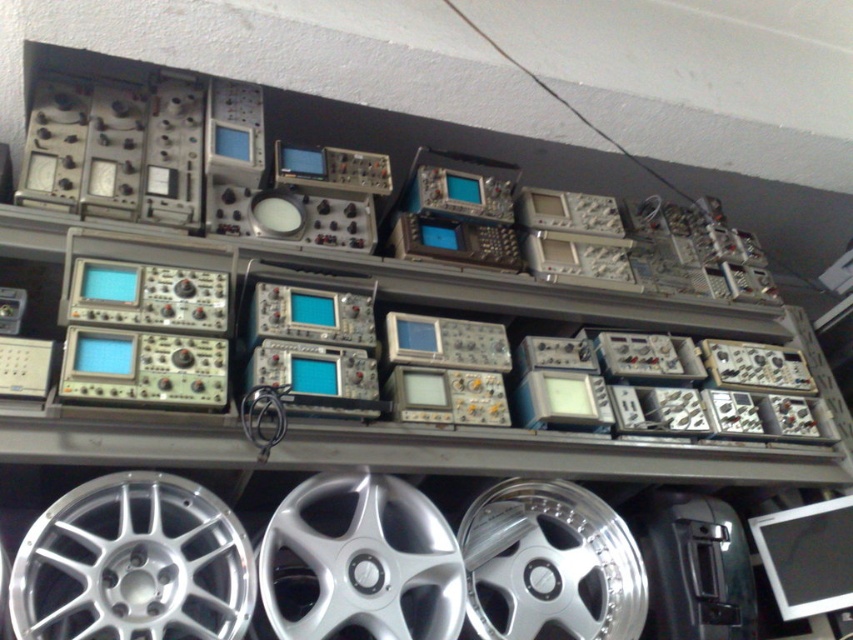
From the picture: Between silver metallic wheel at center and silver polished wheel at lower center, which one appears on the left side from the viewer's perspective?

Positioned to the left is silver metallic wheel at center.

From the picture: Is silver metallic wheel at center wider than silver polished wheel at lower center?

No, silver metallic wheel at center is not wider than silver polished wheel at lower center.

Is point (370, 604) closer to camera compared to point (546, 605)?

Yes, point (370, 604) is closer to viewer.

At what (x,y) coordinates should I click in order to perform the action: click on silver metallic wheel at center. Please return your answer as a coordinate pair (x, y). Looking at the image, I should click on (364, 561).

Can you confirm if silver metallic wheel at lower left is positioned to the left of silver metallic wheel at center?

Correct, you'll find silver metallic wheel at lower left to the left of silver metallic wheel at center.

Between point (106, 605) and point (457, 618), which one is positioned behind?

Point (457, 618)

What do you see at coordinates (132, 564) in the screenshot?
I see `silver metallic wheel at lower left` at bounding box center [132, 564].

You are a GUI agent. You are given a task and a screenshot of the screen. Output one action in this format:
    pyautogui.click(x=<x>, y=<y>)
    Task: Click on the silver metallic wheel at lower left
    
    Given the screenshot: What is the action you would take?
    pyautogui.click(x=132, y=564)

Can you confirm if silver metallic wheel at lower left is positioned above silver polished wheel at lower center?

Yes, silver metallic wheel at lower left is above silver polished wheel at lower center.

Does point (134, 547) lie behind point (509, 579)?

No, (134, 547) is closer to viewer.

Which is behind, point (233, 612) or point (500, 552)?

The point (500, 552) is more distant.

You are a GUI agent. You are given a task and a screenshot of the screen. Output one action in this format:
    pyautogui.click(x=<x>, y=<y>)
    Task: Click on the silver metallic wheel at lower left
    This screenshot has height=640, width=853.
    Given the screenshot: What is the action you would take?
    pyautogui.click(x=132, y=564)